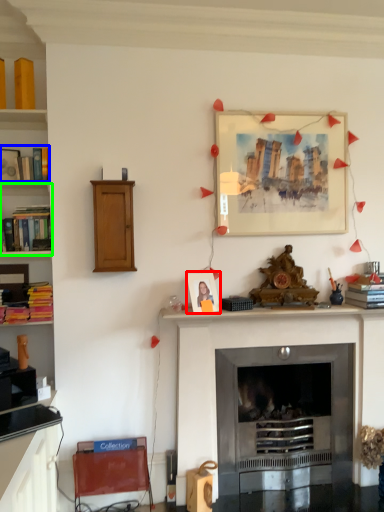
Question: Which object is positioned closest to picture frame (highlighted by a red box)? Select from book (highlighted by a blue box) and shelf (highlighted by a green box).

Choices:
 (A) book
 (B) shelf

Answer: (B)